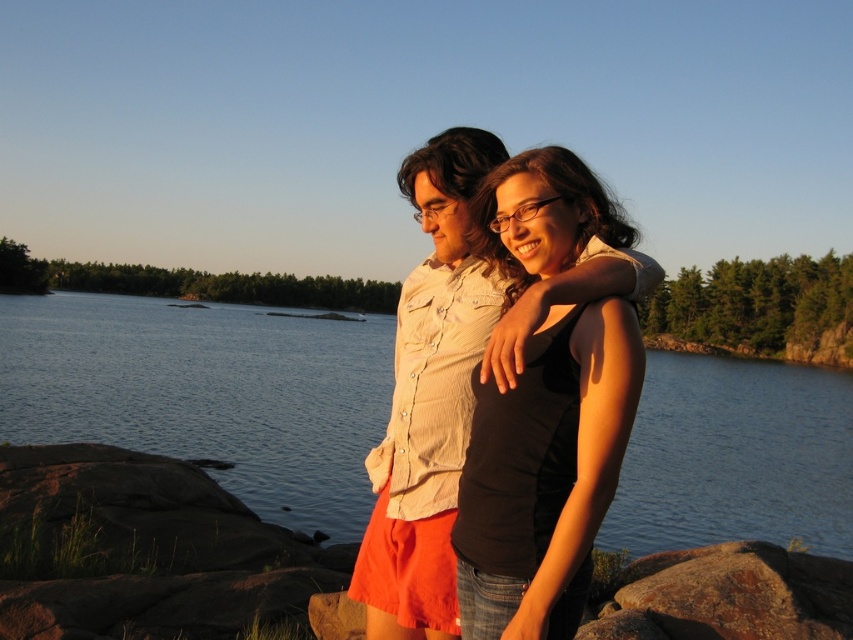
Question: In this image, where is clear water at center located relative to black matte tank top at center?

Choices:
 (A) right
 (B) left

Answer: (B)

Question: Is clear water at center below black matte tank top at center?

Choices:
 (A) no
 (B) yes

Answer: (A)

Question: Which object is farther from the camera taking this photo?

Choices:
 (A) clear water at center
 (B) black matte tank top at center

Answer: (A)

Question: Observing the image, what is the correct spatial positioning of clear water at center in reference to black matte tank top at center?

Choices:
 (A) below
 (B) above

Answer: (B)

Question: Which object appears closest to the camera in this image?

Choices:
 (A) black matte tank top at center
 (B) clear water at center

Answer: (A)

Question: Which point is closer to the camera?

Choices:
 (A) black matte tank top at center
 (B) clear water at center

Answer: (A)